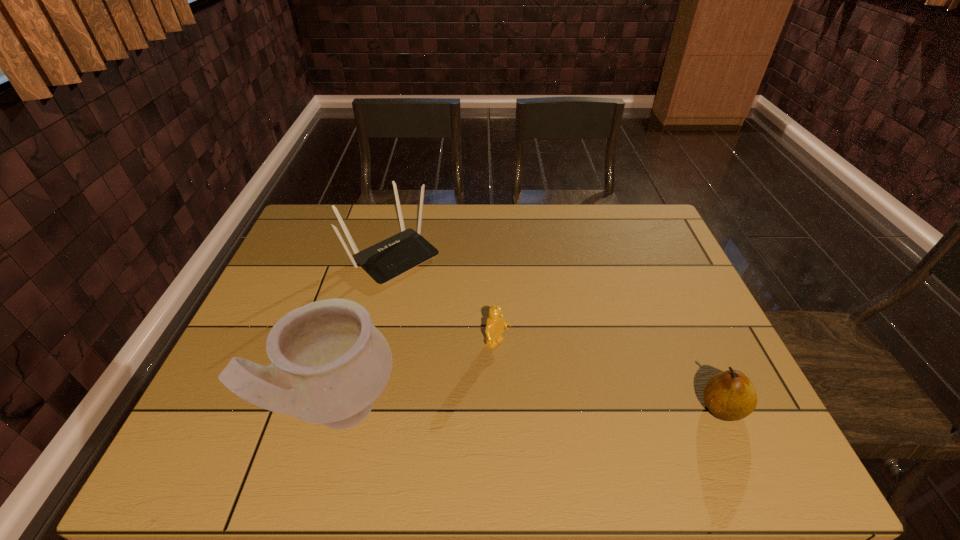
Image resolution: width=960 pixels, height=540 pixels. Identify the location of the tallest object. (329, 363).

This screenshot has width=960, height=540. What are the coordinates of `pear` in the screenshot? It's located at (729, 395).

Locate an element on the screen. Lego is located at coordinates (495, 325).

Locate an element on the screen. Image resolution: width=960 pixels, height=540 pixels. the third object from left to right is located at coordinates (495, 325).

The image size is (960, 540). I want to click on the third shortest object, so click(392, 257).

This screenshot has width=960, height=540. In order to click on router in this screenshot , I will do `click(392, 257)`.

I want to click on free space located 0.260m on the right of the pottery, so click(x=517, y=410).

Locate an element on the screen. The width and height of the screenshot is (960, 540). free space located on the back of the pear is located at coordinates (699, 356).

Find the location of a particular element. Image resolution: width=960 pixels, height=540 pixels. free spot located on the face of the second farthest object is located at coordinates (600, 420).

What are the coordinates of `free space located on the face of the second farthest object` in the screenshot? It's located at (547, 382).